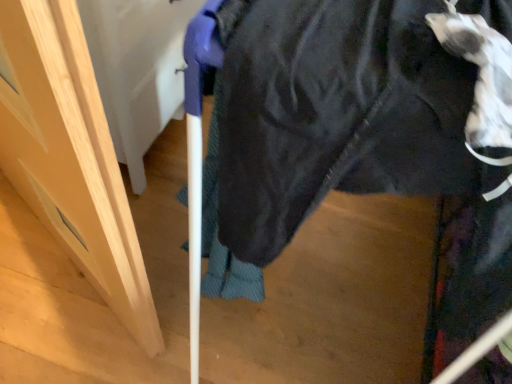
Describe the element at coordinates (70, 156) in the screenshot. I see `light wood door at left` at that location.

This screenshot has width=512, height=384. In order to click on light wood door at left in this screenshot , I will do `click(70, 156)`.

You are a GUI agent. You are given a task and a screenshot of the screen. Output one action in this format:
    pyautogui.click(x=<x>, y=<y>)
    Task: Click on the light wood door at left
    
    Given the screenshot: What is the action you would take?
    pyautogui.click(x=70, y=156)